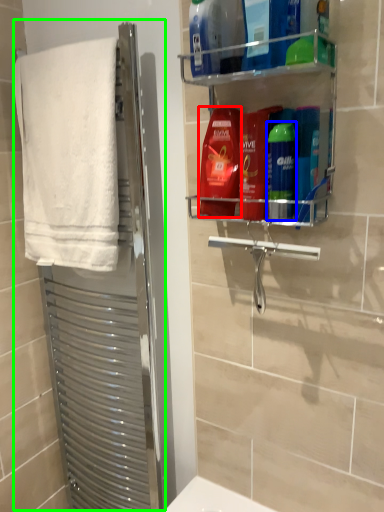
Question: Which is nearer to the cleaning product (highlighted by a red box)? toiletry (highlighted by a blue box) or screen door (highlighted by a green box).

Choices:
 (A) toiletry
 (B) screen door

Answer: (A)